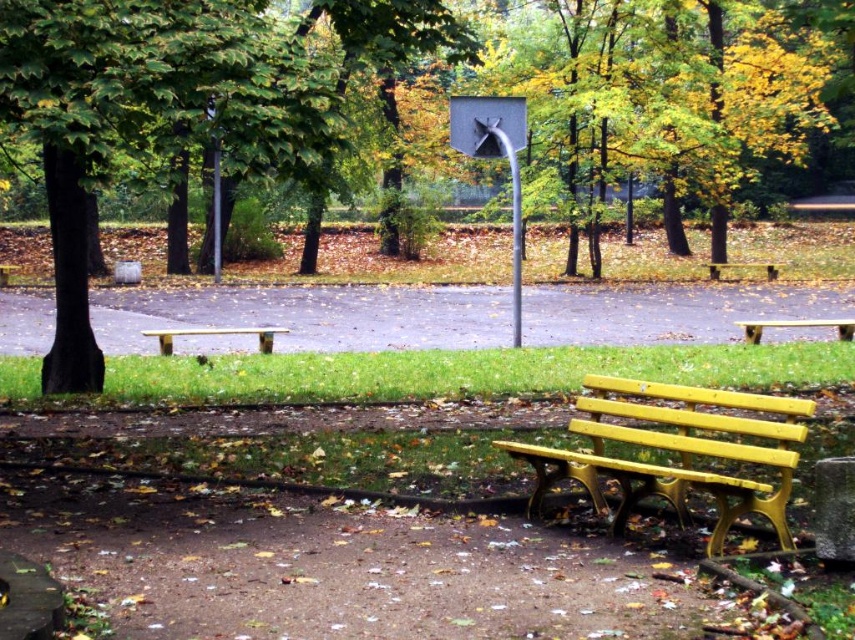
You are a park visitor who wants to place a picnic blanket between the yellow plastic bench at lower right and the yellow painted wood bench at right. The blanket is 10 meters long. Will it fit between the two benches?

The yellow plastic bench at lower right and the yellow painted wood bench at right are 12.36 meters apart from each other. Since the blanket is 10 meters long, it will fit between them with 2.36 meters of space remaining.

You are a park visitor who wants to sit on the benches. Which bench is positioned lower in the image, the yellow plastic bench at lower right or the yellow painted wood bench at right?

The yellow plastic bench at lower right is located below the yellow painted wood bench at right, so it is positioned lower in the image.